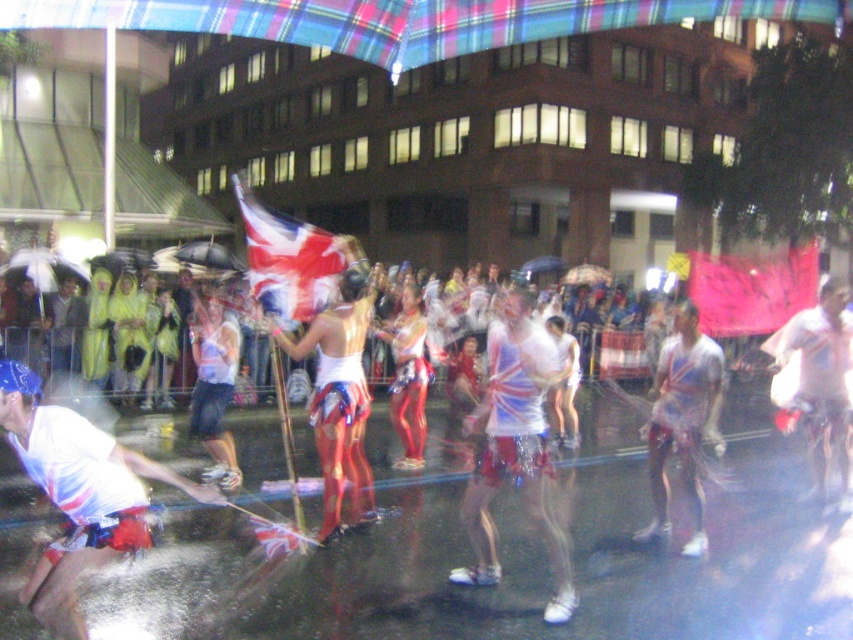
Question: Can you confirm if white glossy shirt at right is smaller than white glossy shirt at center?

Choices:
 (A) yes
 (B) no

Answer: (B)

Question: Which point is farther to the camera?

Choices:
 (A) union jack fabric flag at center
 (B) white glossy shirt at lower left
 (C) white glossy shirt at right
 (D) shiny metallic shorts at center

Answer: (C)

Question: Is white glossy shirt at right above white glossy shirt at center?

Choices:
 (A) no
 (B) yes

Answer: (B)

Question: Which of the following is the closest to the observer?

Choices:
 (A) (665, 454)
 (B) (9, 412)

Answer: (B)

Question: Based on their relative distances, which object is nearer to the shiny metallic shorts at center?

Choices:
 (A) union jack fabric flag at center
 (B) white glossy shirt at right

Answer: (B)

Question: Can you confirm if white glossy shirt at center is positioned to the left of union jack fabric flag at center?

Choices:
 (A) no
 (B) yes

Answer: (A)